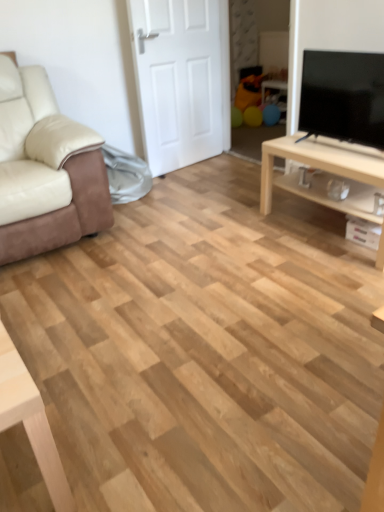
What is the approximate height of light wood/texture tv stand at right?

17.66 inches.

What do you see at coordinates (45, 169) in the screenshot? The width and height of the screenshot is (384, 512). I see `beige leather couch at left` at bounding box center [45, 169].

Describe the element at coordinates (181, 79) in the screenshot. I see `white matte door at center` at that location.

The height and width of the screenshot is (512, 384). I want to click on black glossy tv at upper right, so click(x=343, y=96).

From the image's perspective, is white matte door at center positioned above or below light wood/texture tv stand at right?

white matte door at center is above light wood/texture tv stand at right.

Is white matte door at center to the left or to the right of light wood/texture tv stand at right in the image?

Based on their positions, white matte door at center is located to the left of light wood/texture tv stand at right.

Which is nearer, (x=135, y=40) or (x=312, y=144)?

Point (x=312, y=144)

Is black glossy tv at upper right next to light wood/texture tv stand at right?

No, black glossy tv at upper right is not making contact with light wood/texture tv stand at right.

How distant is black glossy tv at upper right from light wood/texture tv stand at right?

The distance of black glossy tv at upper right from light wood/texture tv stand at right is 8.91 inches.

Who is taller, black glossy tv at upper right or light wood/texture tv stand at right?

black glossy tv at upper right.

From a real-world perspective, between black glossy tv at upper right and light wood/texture tv stand at right, who is vertically higher?

black glossy tv at upper right.

Between beige leather couch at left and light wood/texture tv stand at right, which one appears on the left side from the viewer's perspective?

From the viewer's perspective, beige leather couch at left appears more on the left side.

From the image's perspective, which is below, beige leather couch at left or light wood/texture tv stand at right?

light wood/texture tv stand at right, from the image's perspective.

Considering the relative sizes of beige leather couch at left and light wood/texture tv stand at right in the image provided, is beige leather couch at left shorter than light wood/texture tv stand at right?

No.

In the scene shown: Is beige leather couch at left positioned beyond the bounds of light wood/texture tv stand at right?

That's correct, beige leather couch at left is outside of light wood/texture tv stand at right.

Which of these two, beige leather couch at left or black glossy tv at upper right, stands taller?

With more height is beige leather couch at left.

Identify the location of television that is behind the beige leather couch at left. Image resolution: width=384 pixels, height=512 pixels. (343, 96).

From the image's perspective, who appears lower, beige leather couch at left or black glossy tv at upper right?

beige leather couch at left is shown below in the image.

From the picture: Which is in front, beige leather couch at left or black glossy tv at upper right?

beige leather couch at left is closer to the camera.

Can you tell me how much black glossy tv at upper right and beige leather couch at left differ in facing direction?

They differ by 89.9 degrees in their facing directions.

Between point (363, 105) and point (31, 249), which one is positioned behind?

The point (31, 249) is farther.

Which of these two, black glossy tv at upper right or beige leather couch at left, is thinner?

black glossy tv at upper right is thinner.

Considering the relative sizes of black glossy tv at upper right and beige leather couch at left in the image provided, is black glossy tv at upper right taller than beige leather couch at left?

In fact, black glossy tv at upper right may be shorter than beige leather couch at left.

From a real-world perspective, does light wood/texture tv stand at right stand above white matte door at center?

No.

From the image's perspective, is light wood/texture tv stand at right above or below white matte door at center?

From the image's perspective, light wood/texture tv stand at right appears below white matte door at center.

Considering the sizes of light wood/texture tv stand at right and white matte door at center in the image, is light wood/texture tv stand at right wider or thinner than white matte door at center?

Considering their sizes, light wood/texture tv stand at right looks broader than white matte door at center.

Who is bigger, white matte door at center or black glossy tv at upper right?

white matte door at center.

Does point (157, 26) come farther from viewer compared to point (372, 106)?

Yes, point (157, 26) is behind point (372, 106).

Identify the location of door behind the black glossy tv at upper right. The image size is (384, 512). (181, 79).

Locate an element on the screen. door above the light wood/texture tv stand at right (from the image's perspective) is located at coordinates (181, 79).

Locate an element on the screen. The height and width of the screenshot is (512, 384). television located above the light wood/texture tv stand at right (from a real-world perspective) is located at coordinates (343, 96).

Which object lies nearer to the anchor point light wood/texture tv stand at right, white matte door at center or black glossy tv at upper right?

Among the two, black glossy tv at upper right is located nearer to light wood/texture tv stand at right.

Looking at this image, from the image, which object appears to be farther from beige leather couch at left, light wood/texture tv stand at right or black glossy tv at upper right?

black glossy tv at upper right lies further to beige leather couch at left than the other object.

From the image, which object appears to be nearer to white matte door at center, light wood/texture tv stand at right or black glossy tv at upper right?

light wood/texture tv stand at right is positioned closer to the anchor white matte door at center.

Which object lies further to the anchor point black glossy tv at upper right, white matte door at center or light wood/texture tv stand at right?

Based on the image, white matte door at center appears to be further to black glossy tv at upper right.

Based on their spatial positions, is light wood/texture tv stand at right or white matte door at center closer to beige leather couch at left?

white matte door at center is positioned closer to the anchor beige leather couch at left.

Looking at the image, which one is located further to light wood/texture tv stand at right, white matte door at center or beige leather couch at left?

The object further to light wood/texture tv stand at right is white matte door at center.

When comparing their distances from beige leather couch at left, does black glossy tv at upper right or white matte door at center seem further?

Among the two, black glossy tv at upper right is located further to beige leather couch at left.

When comparing their distances from white matte door at center, does beige leather couch at left or black glossy tv at upper right seem further?

Based on the image, black glossy tv at upper right appears to be further to white matte door at center.

This screenshot has height=512, width=384. I want to click on door located between beige leather couch at left and light wood/texture tv stand at right in the left-right direction, so click(181, 79).

At what (x,y) coordinates should I click in order to perform the action: click on television between beige leather couch at left and light wood/texture tv stand at right from left to right. Please return your answer as a coordinate pair (x, y). The width and height of the screenshot is (384, 512). Looking at the image, I should click on (343, 96).

Identify the location of table located between black glossy tv at upper right and white matte door at center in the depth direction. (321, 161).

What are the coordinates of `door between beige leather couch at left and black glossy tv at upper right in the horizontal direction` in the screenshot? It's located at (181, 79).